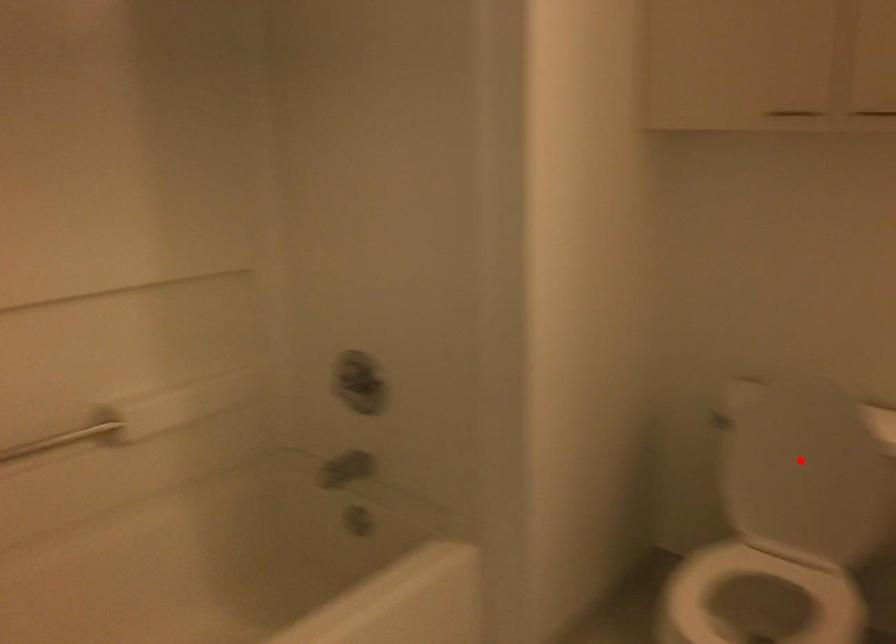
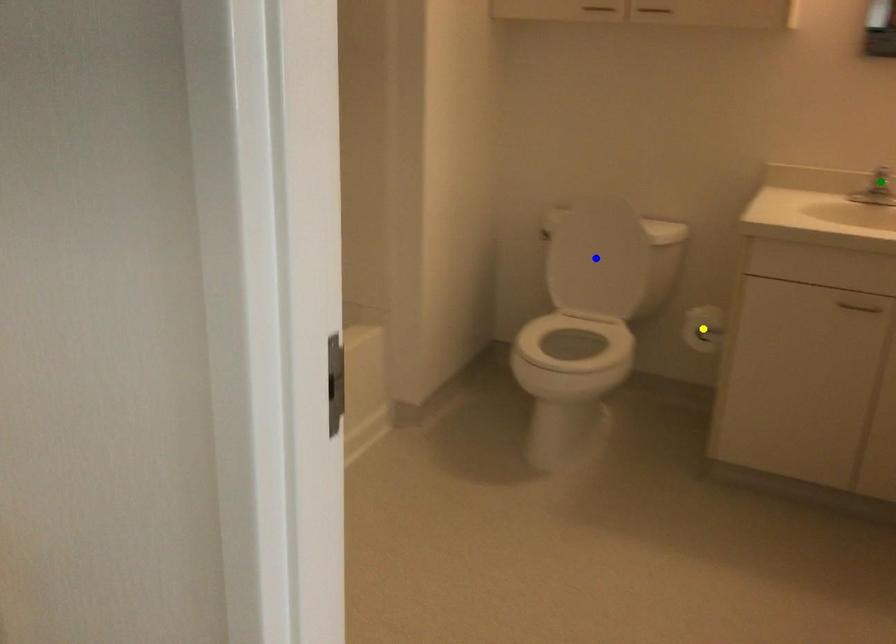
Question: I am providing you with two images of the same scene from different viewpoints. A red point is marked on the first image. You are given multiple points on the second image. Which spot in image 2 lines up with the point in image 1?

Choices:
 (A) green point
 (B) yellow point
 (C) blue point

Answer: (C)